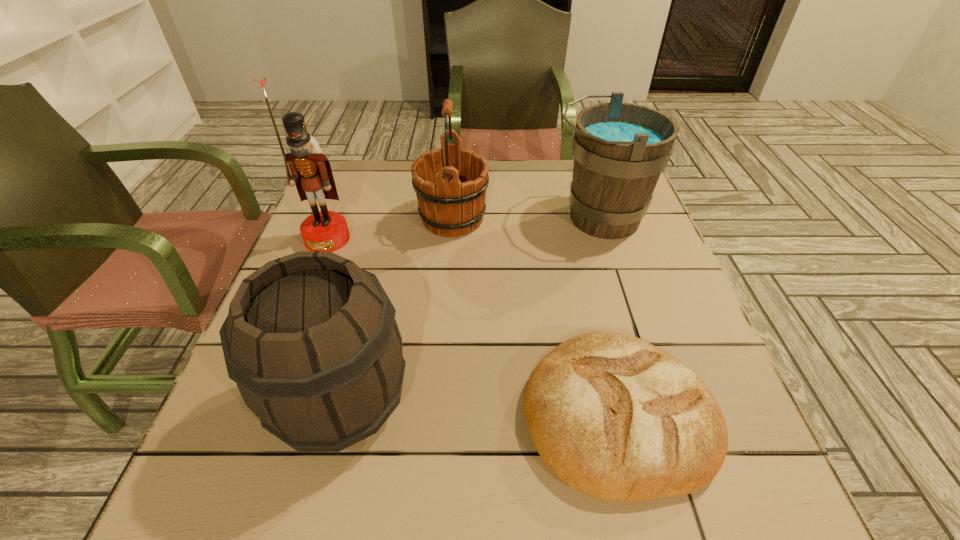
Identify the location of nutcracker. (311, 172).

Identify the location of the rightmost wine bucket. Image resolution: width=960 pixels, height=540 pixels. (620, 149).

This screenshot has width=960, height=540. Find the location of `the nearest wine bucket`. the nearest wine bucket is located at coordinates pos(311,340).

Where is `the shortest object`? The height and width of the screenshot is (540, 960). the shortest object is located at coordinates (614, 417).

Locate an element on the screen. Image resolution: width=960 pixels, height=540 pixels. free space located 0.200m on the front-facing side of the tallest object is located at coordinates (297, 319).

The width and height of the screenshot is (960, 540). Identify the location of vacant area located 0.270m with a handle on the side of the rightmost wine bucket. (444, 218).

The image size is (960, 540). What are the coordinates of `free location located 0.290m with a handle on the side of the rightmost wine bucket` in the screenshot? It's located at (437, 218).

Where is `vacant space located 0.170m with a handle on the side of the rightmost wine bucket`? This screenshot has height=540, width=960. vacant space located 0.170m with a handle on the side of the rightmost wine bucket is located at coordinates (483, 218).

Identify the location of free space located 0.380m on the back of the nearest wine bucket. (386, 226).

Find the location of `blank space located on the back of the bread`. blank space located on the back of the bread is located at coordinates (577, 247).